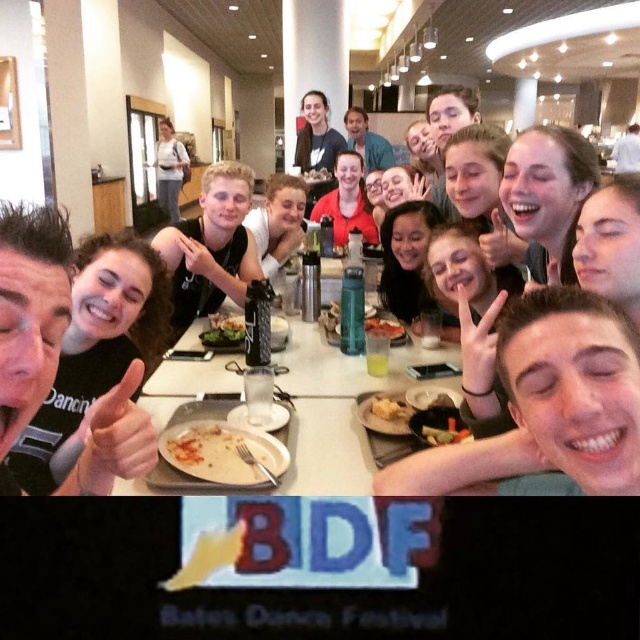
Question: Can you confirm if black matte t-shirt at lower left is positioned below smooth white shirt at center?

Choices:
 (A) no
 (B) yes

Answer: (B)

Question: Which point appears farthest from the camera in this image?

Choices:
 (A) (385, 330)
 (B) (221, 454)
 (C) (380, 406)
 (D) (316, 150)

Answer: (D)

Question: Estimate the real-world distances between objects in this image. Which object is closer to the white matte plate at center?

Choices:
 (A) carrot slice at center
 (B) smooth skin face at center
 (C) matte blue shirt at upper center

Answer: (A)

Question: Can you confirm if smooth white shirt at center is positioned below yellow crumbly food at center?

Choices:
 (A) no
 (B) yes

Answer: (A)

Question: Which point is farther to the camera?

Choices:
 (A) (65, 298)
 (B) (276, 467)
 (C) (314, 120)
 (D) (234, 300)

Answer: (C)

Question: Can you confirm if smooth white shirt at center is positioned below matte red shirt at center?

Choices:
 (A) no
 (B) yes

Answer: (B)